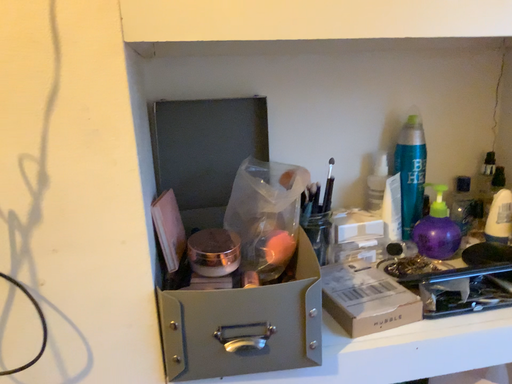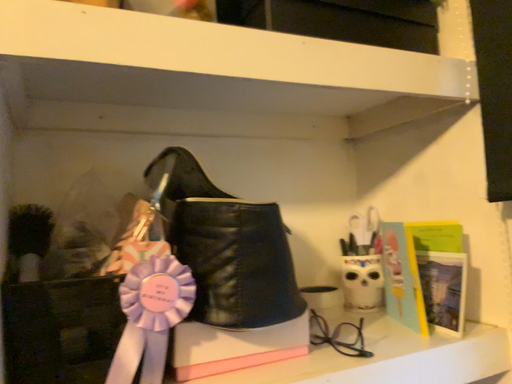
Question: Which way did the camera rotate in the video?

Choices:
 (A) rotated left
 (B) rotated right

Answer: (B)